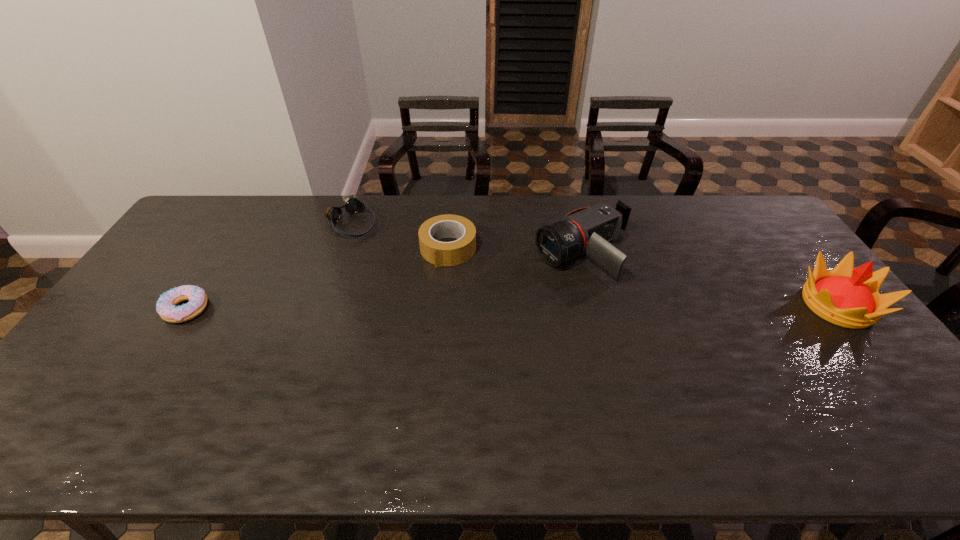
Where is `free space located 0.090m on the lens of the camcorder`? The height and width of the screenshot is (540, 960). free space located 0.090m on the lens of the camcorder is located at coordinates (520, 281).

At what (x,y) coordinates should I click in order to perform the action: click on vacant space located on the lens of the camcorder. Please return your answer as a coordinate pair (x, y). Looking at the image, I should click on (467, 305).

What are the coordinates of `free space located 0.090m on the lens of the camcorder` in the screenshot? It's located at (x=520, y=281).

Locate an element on the screen. vacant space situated 0.070m at the edge of the third object from left to right is located at coordinates 432,283.

Find the location of `vacant space situated at the edge of the third object from left to right`. vacant space situated at the edge of the third object from left to right is located at coordinates [x=396, y=356].

Locate an element on the screen. vacant area situated at the edge of the third object from left to right is located at coordinates (411, 327).

Image resolution: width=960 pixels, height=540 pixels. In order to click on free location located 0.380m through the lenses of the goggles in this screenshot , I will do `click(436, 294)`.

This screenshot has height=540, width=960. In order to click on vacant space located 0.110m through the lenses of the goggles in this screenshot , I will do pos(384,251).

Identify the location of free location located 0.300m through the lenses of the goggles. (420, 280).

Find the location of a particular element. camcorder at the far edge is located at coordinates (588, 230).